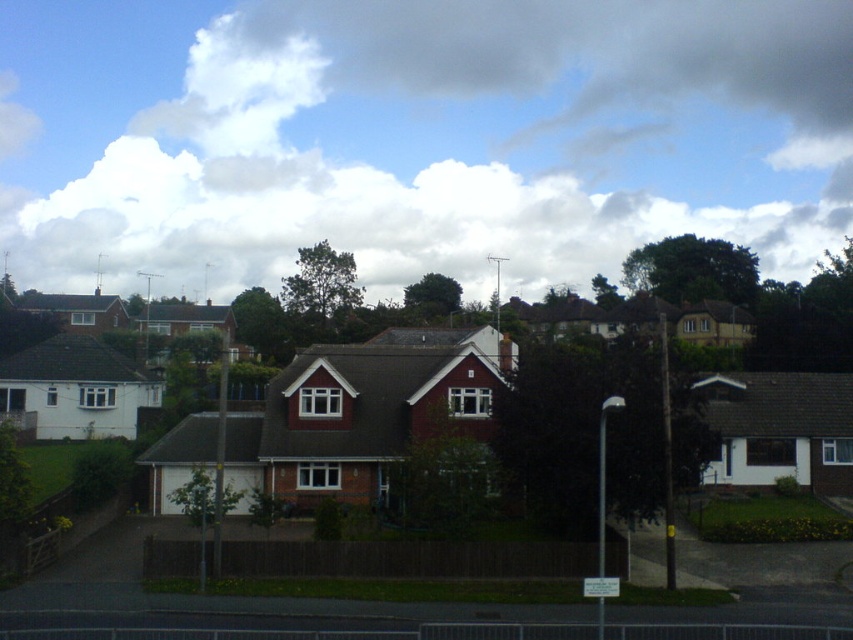
You are a photographer planning to take a wide shot of the suburban house. The white fluffy cloud at upper center and the brown wooden fence at center are both in your frame. Which object will appear wider in the photo?

The white fluffy cloud at upper center will appear wider in the photo because its width is larger than that of the brown wooden fence at center.

You are standing at the point closer to you in the image. Which point are you at, point (224, 278) or point (564, 564)?

You are at point (224, 278) because it is further to the viewer than point (564, 564).

You are a bird flying over a suburban area. You see the white fluffy cloud at upper center and the brown wooden fence at center. Which object is higher in the sky?

The white fluffy cloud at upper center is higher in the sky because it is positioned above the brown wooden fence at center.